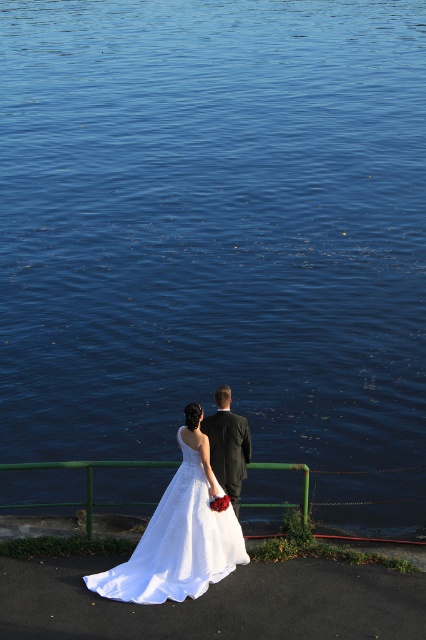
You are a photographer trying to capture the white satin dress at lower center. The camera you are using has a focal length of 50mm. If the dress is at point coordinates (178,540), can you estimate if the dress will be within the camera frame?

The point coordinates (178,540) indicate the location of the white satin dress at lower center. Since the coordinates are within the standard image frame range of 0 to 1, the dress will be within the camera frame.

You are a photographer trying to capture a clear shot of the white satin dress at lower center and the green painted metal railing at lower center. Based on their positions, which object is closer to the camera?

The white satin dress at lower center is closer to the camera since it is in front of the green painted metal railing at lower center.